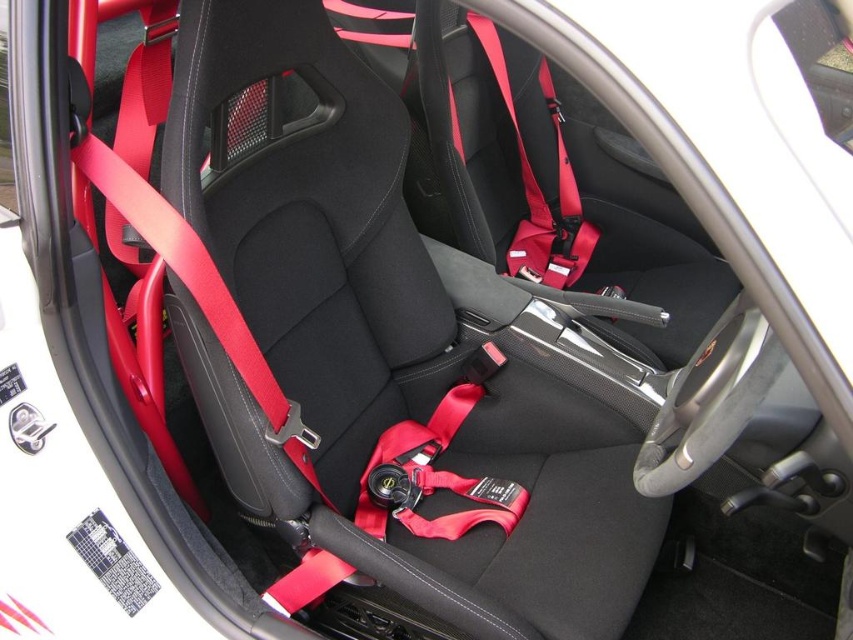
You are a car seat inspector checking the placement of seatbelts. You need to ensure that the distance between the matte red seatbelt at center and the matte red seatbelt at upper right is within the safety standard of 30 inches. Is the current distance compliant?

The distance between the matte red seatbelt at center and the matte red seatbelt at upper right is 33.15 inches, which exceeds the safety standard of 30 inches. Therefore, the current distance is not compliant with the safety requirement.

You are a passenger sitting in the back seat of the car and need to fasten your seatbelt. The matte red seatbelt at center is located in front of you. Can you reach it from your current position?

The matte red seatbelt at center is 1.41 meters away from the viewer. Since the average arm length is about 0.7 meters, you would not be able to reach it from the back seat without moving forward.